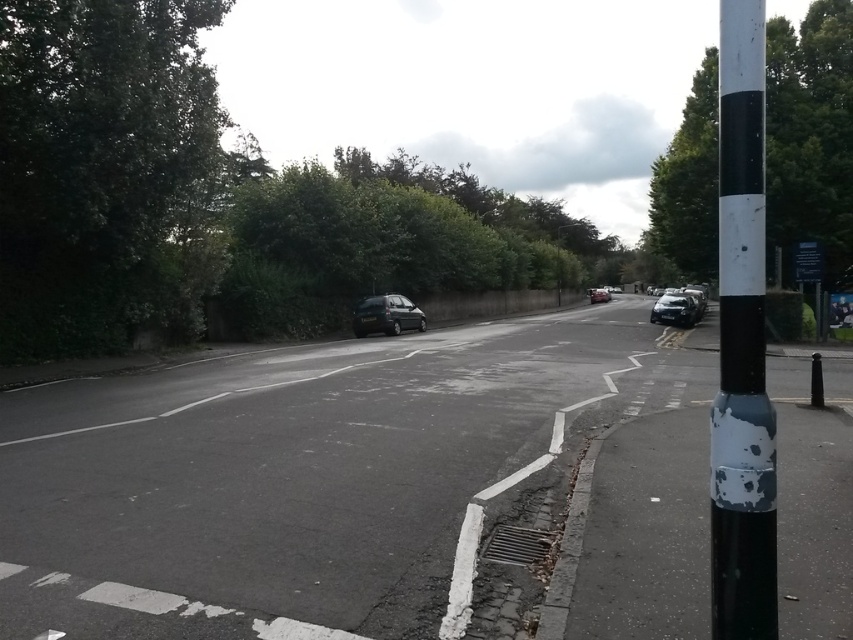
Question: Considering the relative positions of dark gray metallic hatchback at center and shiny silver car at center in the image provided, where is dark gray metallic hatchback at center located with respect to shiny silver car at center?

Choices:
 (A) below
 (B) above

Answer: (A)

Question: Which point is closer to the camera taking this photo?

Choices:
 (A) (808, 252)
 (B) (683, 314)
 (C) (744, 440)

Answer: (C)

Question: Among these objects, which one is nearest to the camera?

Choices:
 (A) green leafy tree at right
 (B) dark gray metallic hatchback at center
 (C) green leafy tree at upper left

Answer: (A)

Question: Which of the following is the closest to the observer?

Choices:
 (A) satin black car at right
 (B) black plastic sign at right
 (C) shiny silver car at center

Answer: (B)

Question: From the image, what is the correct spatial relationship of shiny black car at center in relation to black and white painted pole at right?

Choices:
 (A) above
 (B) below

Answer: (B)

Question: Is green leafy tree at upper left below green leafy tree at right?

Choices:
 (A) no
 (B) yes

Answer: (B)